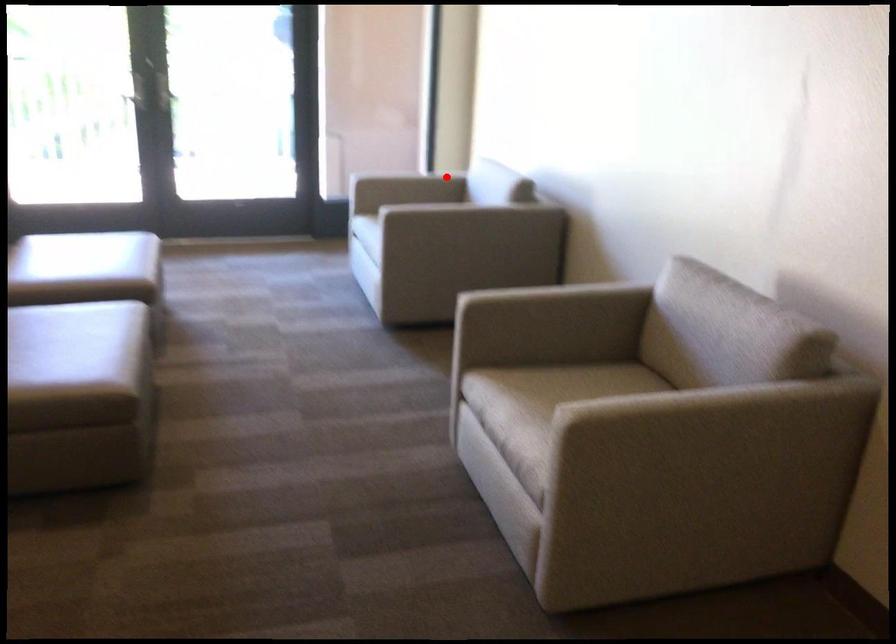
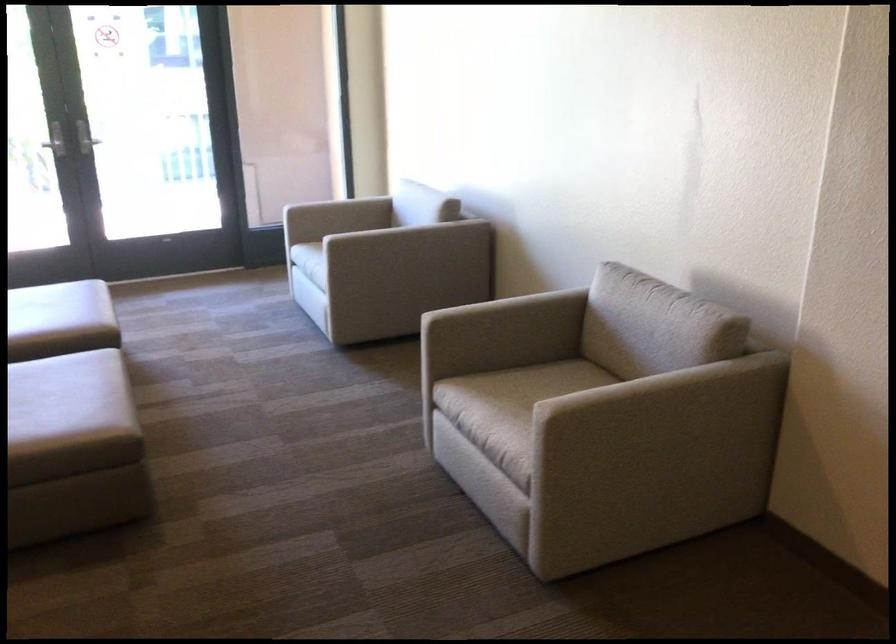
In the second image, find the point that corresponds to the highlighted location in the first image.

(375, 200)